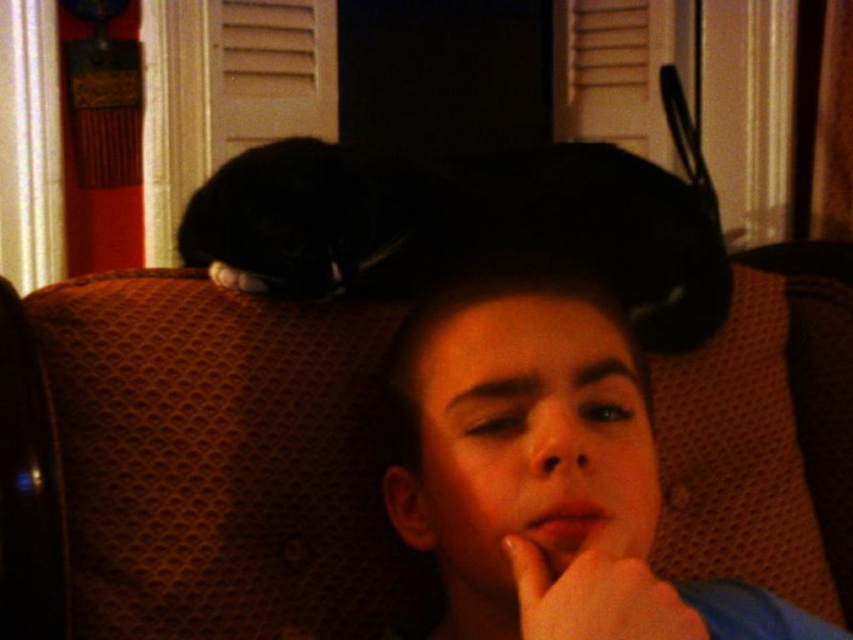
Is black fur cat at upper center wider than matte skin hand at lower center?

Yes.

The width and height of the screenshot is (853, 640). Find the location of `black fur cat at upper center`. black fur cat at upper center is located at coordinates (465, 227).

The image size is (853, 640). What do you see at coordinates (465, 227) in the screenshot?
I see `black fur cat at upper center` at bounding box center [465, 227].

This screenshot has height=640, width=853. I want to click on black fur cat at upper center, so click(x=465, y=227).

Which is above, smooth skin face at center or matte skin hand at lower center?

smooth skin face at center is higher up.

Is smooth skin face at center to the left of matte skin hand at lower center from the viewer's perspective?

Yes, smooth skin face at center is to the left of matte skin hand at lower center.

Is point (451, 547) farther from viewer compared to point (531, 595)?

Yes, point (451, 547) is farther from viewer.

Find the location of a particular element. Image resolution: width=853 pixels, height=640 pixels. smooth skin face at center is located at coordinates (527, 465).

Does smooth skin face at center have a lesser width compared to black fur cat at upper center?

Yes.

Which is below, smooth skin face at center or black fur cat at upper center?

Positioned lower is smooth skin face at center.

Does point (488, 298) come farther from viewer compared to point (416, 227)?

No.

Where is `smooth skin face at center`? The width and height of the screenshot is (853, 640). smooth skin face at center is located at coordinates (527, 465).